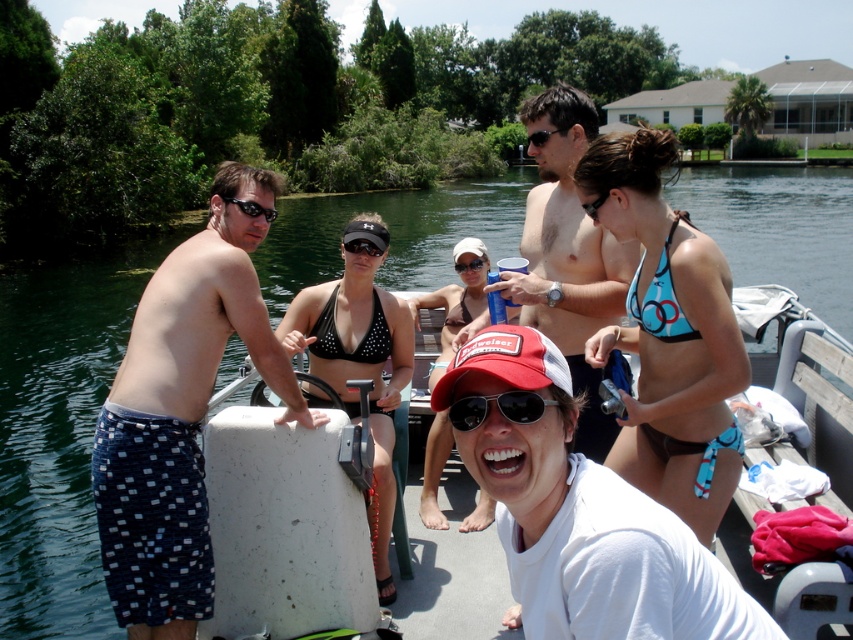
The height and width of the screenshot is (640, 853). Describe the element at coordinates (669, 336) in the screenshot. I see `blue printed bikini at upper right` at that location.

Does blue printed bikini at upper right appear over black rubber goggles at center?

Yes.

Is point (614, 458) farther from viewer compared to point (605, 196)?

Yes, point (614, 458) is farther from viewer.

What are the coordinates of `blue printed bikini at upper right` in the screenshot? It's located at (669, 336).

Is sunglassestransparent at center below transparent plastic goggles at center?

Yes.

Is point (486, 397) farther from viewer compared to point (462, 266)?

No.

Between point (476, 401) and point (457, 262), which one is positioned in front?

Positioned in front is point (476, 401).

The width and height of the screenshot is (853, 640). Find the location of `sunglassestransparent at center`. sunglassestransparent at center is located at coordinates (498, 408).

Is black dotted bikini at upper center below black rubber goggles at center?

Yes, black dotted bikini at upper center is below black rubber goggles at center.

Locate an element on the screen. The height and width of the screenshot is (640, 853). black dotted bikini at upper center is located at coordinates (358, 362).